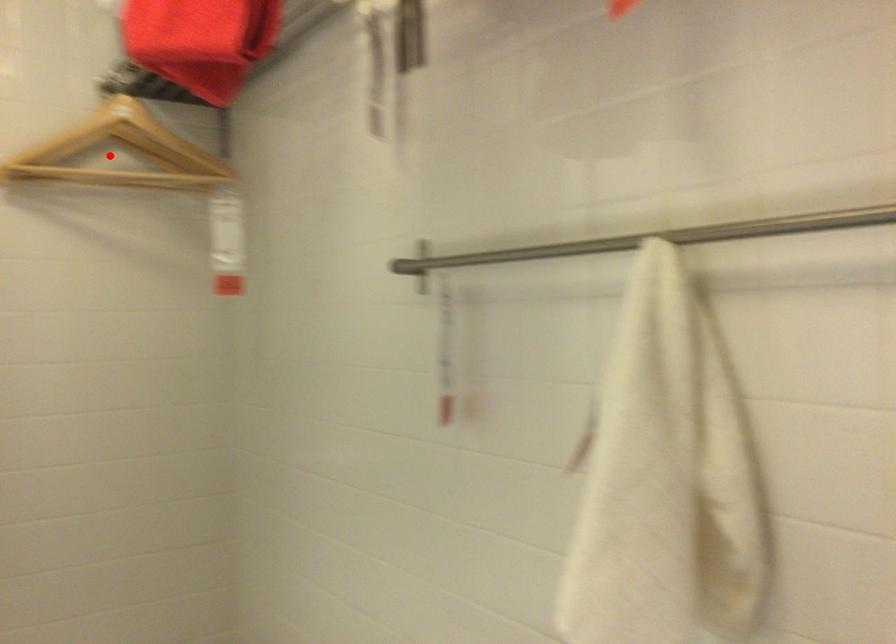
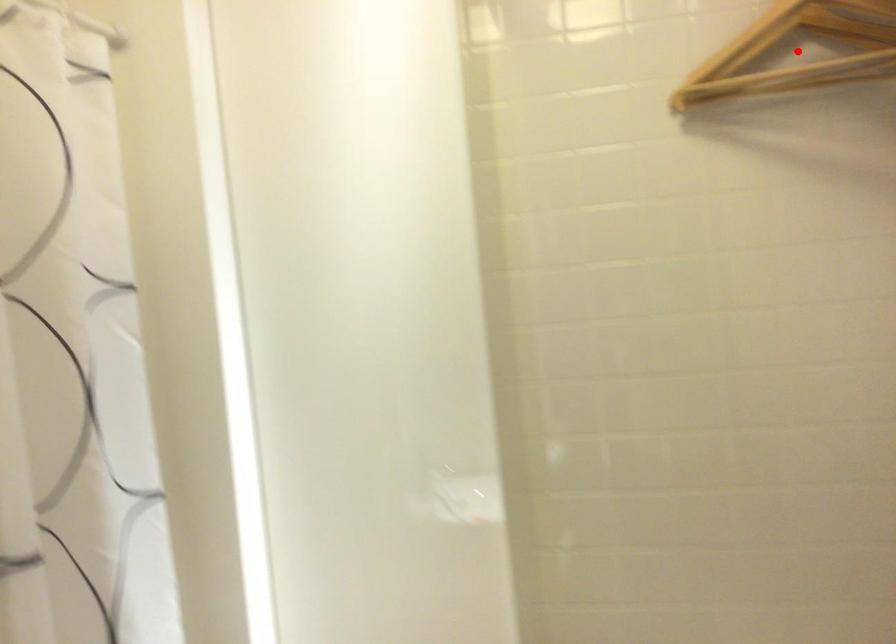
I am providing you with two images of the same scene from different viewpoints. A red point is marked on the first image and another point is marked on the second image. Does the point marked in image1 correspond to the same location as the one in image2?

Yes